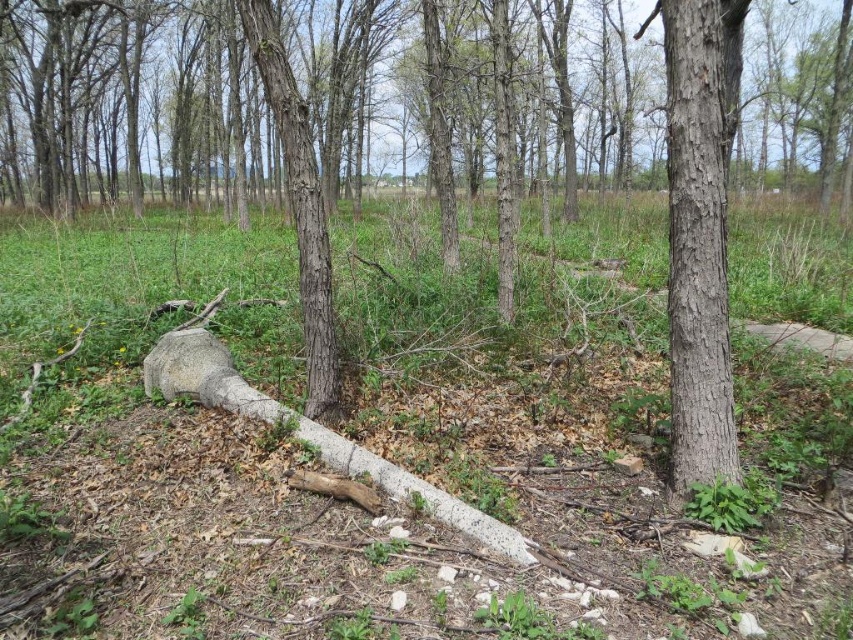
You are standing in the wooded area and want to locate two specific points marked in the image. Which of the two points, point (700, 467) or point (288, 92), is closer to you?

Point (700, 467) is closer to the viewer than point (288, 92).

You are a park maintenance worker who needs to identify the thinnest tree trunk for pruning. Which one between the smooth brown bark at right and the smooth bark tree trunk at center should you choose?

The smooth brown bark at right is thinner than the smooth bark tree trunk at center, so you should choose the smooth brown bark at right for pruning.